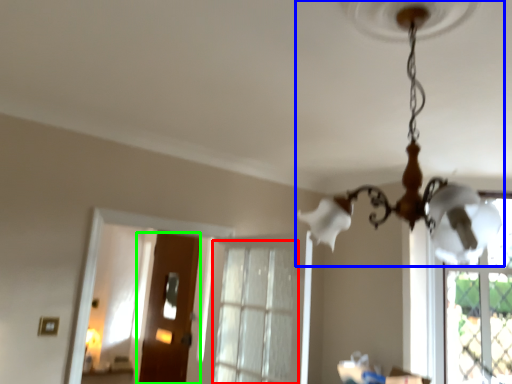
Question: Estimate the real-world distances between objects in this image. Which object is farther from window (highlighted by a red box), lamp (highlighted by a blue box) or door (highlighted by a green box)?

Choices:
 (A) lamp
 (B) door

Answer: (A)